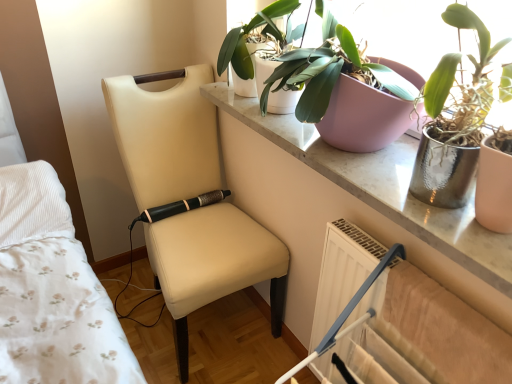
How much space does green matte plant at upper center, the first houseplant when ordered from left to right, occupy horizontally?

green matte plant at upper center, the first houseplant when ordered from left to right, is 10.63 inches wide.

What do you see at coordinates (261, 33) in the screenshot? I see `green matte plant at upper center, which is the 3th houseplant in right-to-left order` at bounding box center [261, 33].

This screenshot has height=384, width=512. In order to click on metallic silver pot at upper right, placed as the second houseplant when sorted from left to right in this screenshot , I will do `click(477, 35)`.

Where is `beige leather chair at center`? The image size is (512, 384). beige leather chair at center is located at coordinates (189, 200).

What do you see at coordinates (397, 205) in the screenshot? This screenshot has height=384, width=512. I see `matte white table at upper right` at bounding box center [397, 205].

The width and height of the screenshot is (512, 384). I want to click on metallic silver pot at upper right, which is the first houseplant from right to left, so click(x=454, y=119).

Locate an element on the screen. The image size is (512, 384). houseplant that is on the right side of metallic silver pot at upper right, placed as the second houseplant when sorted from left to right is located at coordinates (454, 119).

Does point (448, 156) come closer to viewer compared to point (487, 57)?

No, it is not.

Do you think metallic silver pot at upper right, which is the first houseplant from right to left, is within metallic silver pot at upper right, placed as the second houseplant when sorted from left to right, or outside of it?

metallic silver pot at upper right, which is the first houseplant from right to left, lies outside metallic silver pot at upper right, placed as the second houseplant when sorted from left to right.

Looking at their sizes, would you say green matte plant at upper center, the first houseplant when ordered from left to right, is wider or thinner than matte white table at upper right?

green matte plant at upper center, the first houseplant when ordered from left to right, is thinner than matte white table at upper right.

From the image's perspective, is green matte plant at upper center, which is the 3th houseplant in right-to-left order, above or below matte white table at upper right?

green matte plant at upper center, which is the 3th houseplant in right-to-left order, is above matte white table at upper right.

Is matte white table at upper right inside green matte plant at upper center, the first houseplant when ordered from left to right?

Definitely not — matte white table at upper right is not inside green matte plant at upper center, the first houseplant when ordered from left to right.

Does beige leather chair at center come behind matte white table at upper right?

That is True.

Measure the distance between beige leather chair at center and matte white table at upper right.

44.94 centimeters.

I want to click on chair below the matte white table at upper right (from the image's perspective), so click(189, 200).

Consider the image. Can you tell me how much beige leather chair at center and matte white table at upper right differ in facing direction?

The facing directions of beige leather chair at center and matte white table at upper right are 89 degrees apart.

Is matte white table at upper right not within green matte plant at upper center, which is the 3th houseplant in right-to-left order?

Yes, matte white table at upper right is outside of green matte plant at upper center, which is the 3th houseplant in right-to-left order.

Which is closer, (318, 163) or (266, 30)?

Clearly, point (318, 163) is closer to the camera than point (266, 30).

At what (x,y) coordinates should I click in order to perform the action: click on houseplant to the left of matte white table at upper right. Please return your answer as a coordinate pair (x, y). Image resolution: width=512 pixels, height=384 pixels. Looking at the image, I should click on (261, 33).

Which object is further away from the camera taking this photo, metallic silver pot at upper right, acting as the 3th houseplant starting from the left, or matte white table at upper right?

matte white table at upper right is further away from the camera.

Which is correct: metallic silver pot at upper right, which is the first houseplant from right to left, is inside matte white table at upper right, or outside of it?

metallic silver pot at upper right, which is the first houseplant from right to left, is spatially situated outside matte white table at upper right.

Is metallic silver pot at upper right, acting as the 3th houseplant starting from the left, facing towards matte white table at upper right?

No, metallic silver pot at upper right, acting as the 3th houseplant starting from the left, does not turn towards matte white table at upper right.

Considering the relative positions of metallic silver pot at upper right, which is the first houseplant from right to left, and matte white table at upper right in the image provided, is metallic silver pot at upper right, which is the first houseplant from right to left, to the left of matte white table at upper right from the viewer's perspective?

Incorrect, metallic silver pot at upper right, which is the first houseplant from right to left, is not on the left side of matte white table at upper right.

From a real-world perspective, is beige leather chair at center above or below metallic silver pot at upper right, acting as the 3th houseplant starting from the left?

beige leather chair at center is below metallic silver pot at upper right, acting as the 3th houseplant starting from the left.

Between point (167, 131) and point (456, 56), which one is positioned in front?

The point (456, 56) is closer to the camera.

Is beige leather chair at center bigger or smaller than metallic silver pot at upper right, acting as the 3th houseplant starting from the left?

In the image, beige leather chair at center appears to be larger than metallic silver pot at upper right, acting as the 3th houseplant starting from the left.

Consider the image. Measure the distance between beige leather chair at center and metallic silver pot at upper right, acting as the 3th houseplant starting from the left.

beige leather chair at center is 32.81 inches away from metallic silver pot at upper right, acting as the 3th houseplant starting from the left.

Is metallic silver pot at upper right, which is the first houseplant from right to left, wider than green matte plant at upper center, which is the 3th houseplant in right-to-left order?

Correct, the width of metallic silver pot at upper right, which is the first houseplant from right to left, exceeds that of green matte plant at upper center, which is the 3th houseplant in right-to-left order.

From a real-world perspective, is metallic silver pot at upper right, which is the first houseplant from right to left, above or below green matte plant at upper center, the first houseplant when ordered from left to right?

Clearly, from a real-world perspective, metallic silver pot at upper right, which is the first houseplant from right to left, is above green matte plant at upper center, the first houseplant when ordered from left to right.

Is metallic silver pot at upper right, which is the first houseplant from right to left, with green matte plant at upper center, the first houseplant when ordered from left to right?

No, metallic silver pot at upper right, which is the first houseplant from right to left, is not touching green matte plant at upper center, the first houseplant when ordered from left to right.

Identify the location of houseplant that is the 2nd one when counting backward from the metallic silver pot at upper right, acting as the 3th houseplant starting from the left. The image size is (512, 384). (261, 33).

From the metallic silver pot at upper right, acting as the 3th houseplant starting from the left, count the 1st houseplant to the left and point to it. Please provide its 2D coordinates.

[(477, 35)]

Where is `table lying in front of the green matte plant at upper center, the first houseplant when ordered from left to right`? table lying in front of the green matte plant at upper center, the first houseplant when ordered from left to right is located at coordinates (397, 205).

Based on their spatial positions, is matte white table at upper right or metallic silver pot at upper right, placed as the second houseplant when sorted from left to right, further from metallic silver pot at upper right, which is the first houseplant from right to left?

matte white table at upper right.

When comparing their distances from matte white table at upper right, does metallic silver pot at upper right, which is the first houseplant from right to left, or beige leather chair at center seem further?

beige leather chair at center lies further to matte white table at upper right than the other object.

When comparing their distances from metallic silver pot at upper right, marked as the 2th houseplant in a right-to-left arrangement, does matte white table at upper right or beige leather chair at center seem closer?

matte white table at upper right.

Based on their spatial positions, is metallic silver pot at upper right, placed as the second houseplant when sorted from left to right, or metallic silver pot at upper right, acting as the 3th houseplant starting from the left, closer to matte white table at upper right?

metallic silver pot at upper right, placed as the second houseplant when sorted from left to right.

When comparing their distances from metallic silver pot at upper right, acting as the 3th houseplant starting from the left, does green matte plant at upper center, the first houseplant when ordered from left to right, or matte white table at upper right seem further?

The object further to metallic silver pot at upper right, acting as the 3th houseplant starting from the left, is green matte plant at upper center, the first houseplant when ordered from left to right.

From the image, which object appears to be nearer to metallic silver pot at upper right, placed as the second houseplant when sorted from left to right, green matte plant at upper center, which is the 3th houseplant in right-to-left order, or metallic silver pot at upper right, which is the first houseplant from right to left?

Based on the image, metallic silver pot at upper right, which is the first houseplant from right to left, appears to be nearer to metallic silver pot at upper right, placed as the second houseplant when sorted from left to right.

Estimate the real-world distances between objects in this image. Which object is closer to green matte plant at upper center, the first houseplant when ordered from left to right, metallic silver pot at upper right, acting as the 3th houseplant starting from the left, or matte white table at upper right?

matte white table at upper right lies closer to green matte plant at upper center, the first houseplant when ordered from left to right, than the other object.

Based on their spatial positions, is matte white table at upper right or metallic silver pot at upper right, which is the first houseplant from right to left, closer to beige leather chair at center?

matte white table at upper right is closer to beige leather chair at center.

Where is `table between green matte plant at upper center, the first houseplant when ordered from left to right, and beige leather chair at center, in the vertical direction`? Image resolution: width=512 pixels, height=384 pixels. table between green matte plant at upper center, the first houseplant when ordered from left to right, and beige leather chair at center, in the vertical direction is located at coordinates (397, 205).

The width and height of the screenshot is (512, 384). I want to click on houseplant between metallic silver pot at upper right, acting as the 3th houseplant starting from the left, and green matte plant at upper center, which is the 3th houseplant in right-to-left order, from front to back, so click(477, 35).

At what (x,y) coordinates should I click in order to perform the action: click on table between metallic silver pot at upper right, marked as the 2th houseplant in a right-to-left arrangement, and green matte plant at upper center, which is the 3th houseplant in right-to-left order, along the z-axis. Please return your answer as a coordinate pair (x, y). The width and height of the screenshot is (512, 384). Looking at the image, I should click on (397, 205).

The height and width of the screenshot is (384, 512). I want to click on table positioned between metallic silver pot at upper right, acting as the 3th houseplant starting from the left, and green matte plant at upper center, which is the 3th houseplant in right-to-left order, from near to far, so click(397, 205).